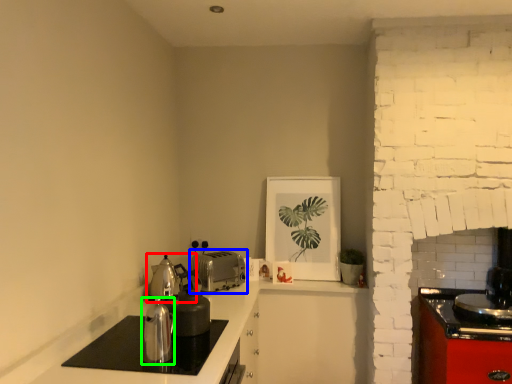
Question: Considering the real-world distances, which object is farthest from tea pot (highlighted by a red box)? toaster (highlighted by a blue box) or kitchen appliance (highlighted by a green box)?

Choices:
 (A) toaster
 (B) kitchen appliance

Answer: (B)